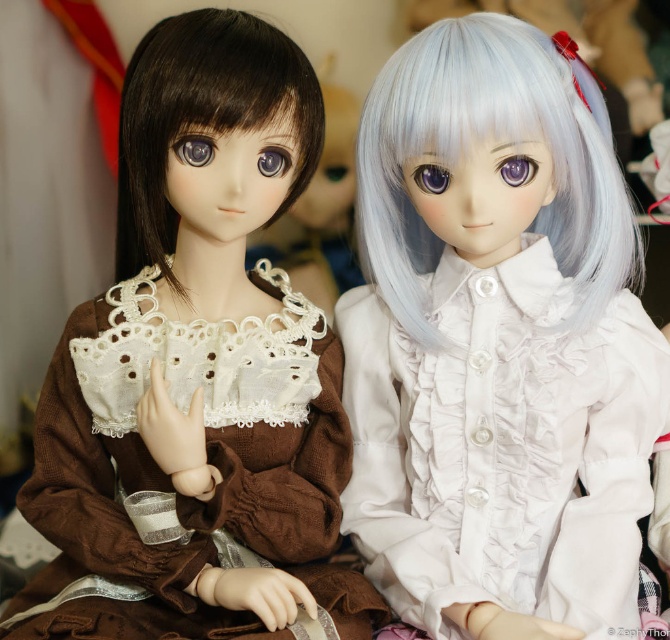
Question: Is brown corduroy dress at left thinner than semi-glossy white wig at center?

Choices:
 (A) no
 (B) yes

Answer: (A)

Question: Based on their relative distances, which object is nearer to the semi-glossy white wig at center?

Choices:
 (A) satin white blouse at center
 (B) brown corduroy dress at left
 (C) brown silky hair at left

Answer: (A)

Question: In this image, where is brown corduroy dress at left located relative to brown silky hair at left?

Choices:
 (A) below
 (B) above

Answer: (A)

Question: Among these objects, which one is nearest to the camera?

Choices:
 (A) satin white blouse at center
 (B) brown silky hair at left
 (C) semi-glossy white wig at center
 (D) brown corduroy dress at left

Answer: (D)

Question: Which object is positioned closest to the brown silky hair at left?

Choices:
 (A) satin white blouse at center
 (B) brown corduroy dress at left
 (C) semi-glossy white wig at center

Answer: (B)

Question: Observing the image, what is the correct spatial positioning of satin white blouse at center in reference to semi-glossy white wig at center?

Choices:
 (A) left
 (B) right

Answer: (A)